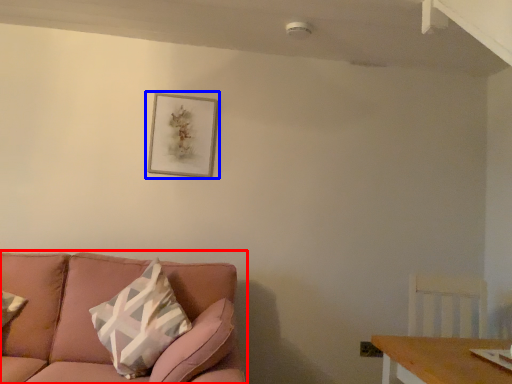
Question: Which object is closer to the camera taking this photo, studio couch (highlighted by a red box) or picture frame (highlighted by a blue box)?

Choices:
 (A) studio couch
 (B) picture frame

Answer: (A)